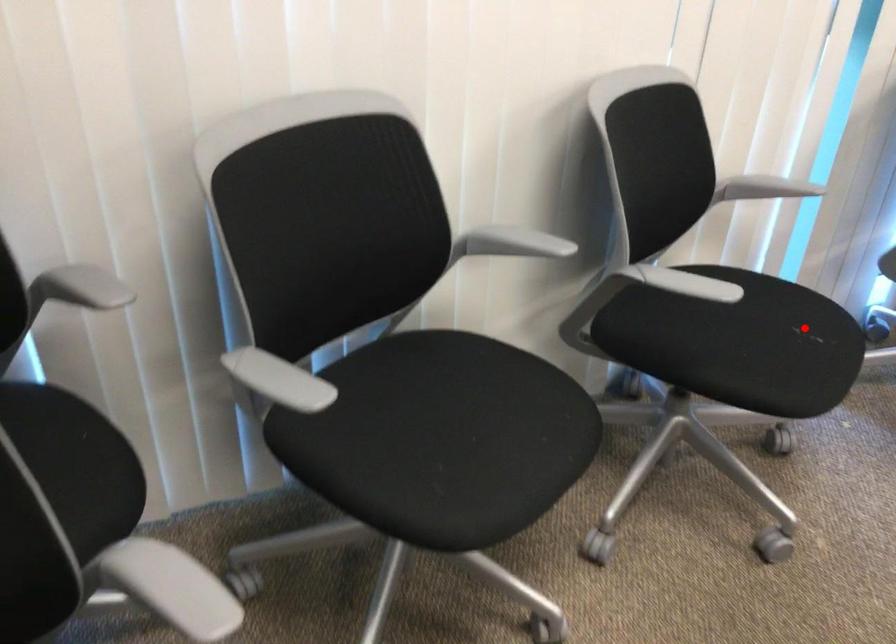
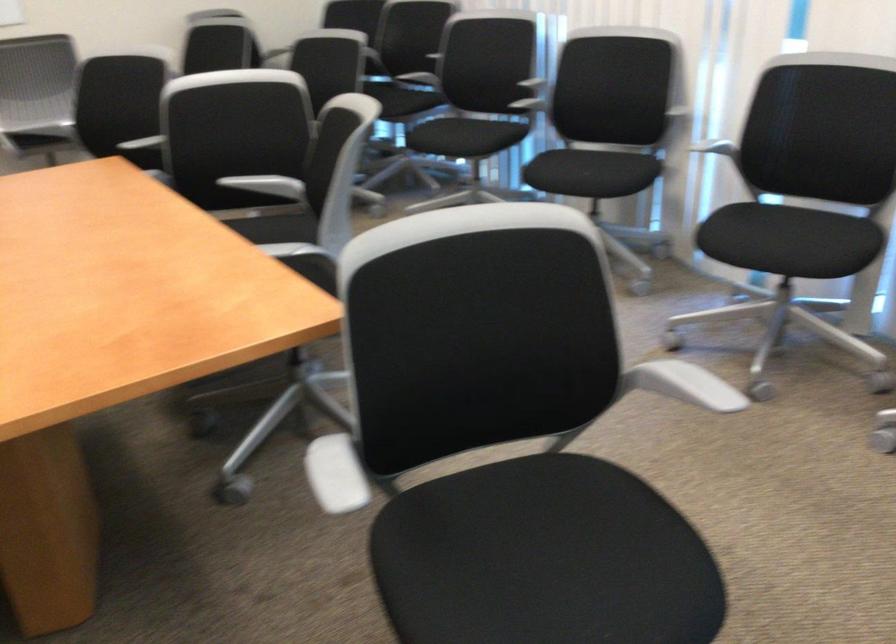
Question: I am providing you with two images of the same scene from different viewpoints. In image1, a red point is highlighted. Considering the same 3D point in image2, which of the following is correct?

Choices:
 (A) It is closer
 (B) It is farther

Answer: (B)